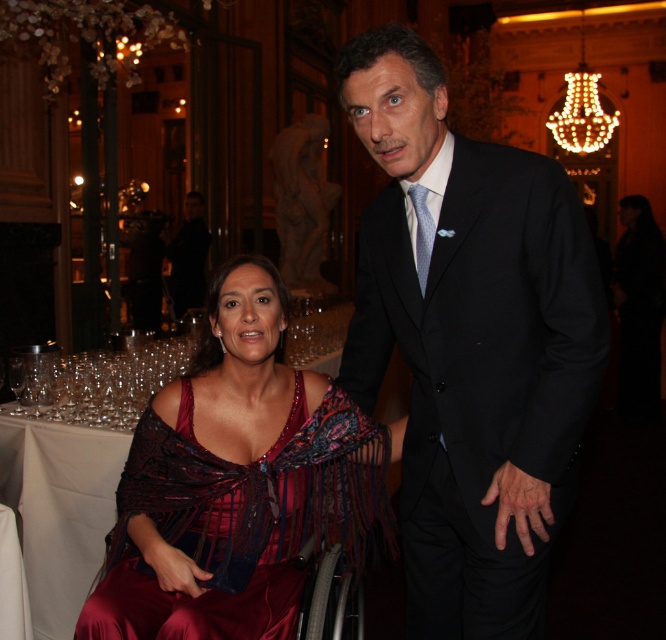
Is black silk suit at center thinner than burgundy satin dress at center?

Yes.

Looking at this image, which of these two, black silk suit at center or burgundy satin dress at center, stands shorter?

Standing shorter between the two is burgundy satin dress at center.

Is point (525, 196) less distant than point (224, 460)?

Yes, point (525, 196) is closer to viewer.

Locate an element on the screen. black silk suit at center is located at coordinates (470, 340).